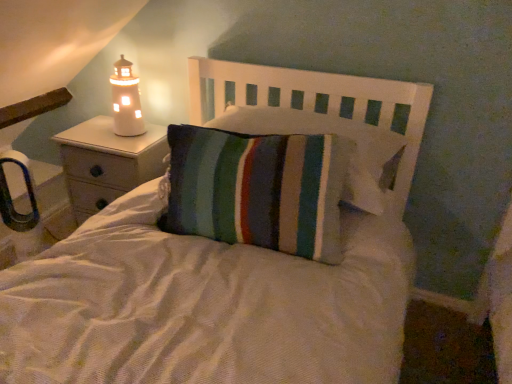
What do you see at coordinates (218, 289) in the screenshot?
I see `striped fabric pillow at center` at bounding box center [218, 289].

The width and height of the screenshot is (512, 384). Describe the element at coordinates (327, 133) in the screenshot. I see `striped fabric pillow at center` at that location.

Find the location of a particular element. The height and width of the screenshot is (384, 512). white ceramic lighthouse at left is located at coordinates (126, 100).

Is matte white nightstand at left not close to striped fabric pillow at center?

Actually, matte white nightstand at left and striped fabric pillow at center are a little close together.

Which is in front, matte white nightstand at left or striped fabric pillow at center?

striped fabric pillow at center is in front.

Considering the sizes of objects matte white nightstand at left and striped fabric pillow at center in the image provided, who is taller, matte white nightstand at left or striped fabric pillow at center?

matte white nightstand at left is taller.

Considering the sizes of matte white nightstand at left and striped fabric pillow at center in the image, is matte white nightstand at left bigger or smaller than striped fabric pillow at center?

In the image, matte white nightstand at left appears to be larger than striped fabric pillow at center.

Between white ceramic lighthouse at left and matte white nightstand at left, which one has less height?

Standing shorter between the two is white ceramic lighthouse at left.

Are white ceramic lighthouse at left and matte white nightstand at left located far from each other?

No, white ceramic lighthouse at left is not far from matte white nightstand at left.

Is white ceramic lighthouse at left thinner than matte white nightstand at left?

Yes, white ceramic lighthouse at left is thinner than matte white nightstand at left.

Which point is more distant from viewer, [128,125] or [89,183]?

The point [89,183] is farther.

Based on the photo, from a real-world perspective, is matte white nightstand at left located beneath striped fabric pillow at center?

Indeed, from a real-world perspective, matte white nightstand at left is positioned beneath striped fabric pillow at center.

Is matte white nightstand at left positioned beyond the bounds of striped fabric pillow at center?

matte white nightstand at left is positioned outside striped fabric pillow at center.

From the image's perspective, is matte white nightstand at left below striped fabric pillow at center?

Indeed, from the image's perspective, matte white nightstand at left is shown beneath striped fabric pillow at center.

Can you tell me how much matte white nightstand at left and striped fabric pillow at center differ in facing direction?

The facing directions of matte white nightstand at left and striped fabric pillow at center are 0.744 degrees apart.

In the scene shown: Does striped fabric pillow at center contain white ceramic lighthouse at left?

Definitely not — white ceramic lighthouse at left is not inside striped fabric pillow at center.

Considering the relative positions of striped fabric pillow at center and white ceramic lighthouse at left in the image provided, is striped fabric pillow at center to the left or to the right of white ceramic lighthouse at left?

striped fabric pillow at center is to the right of white ceramic lighthouse at left.

How much distance is there between striped fabric pillow at center and white ceramic lighthouse at left?

A distance of 70.77 centimeters exists between striped fabric pillow at center and white ceramic lighthouse at left.

Can you confirm if striped fabric pillow at center is shorter than white ceramic lighthouse at left?

Indeed, striped fabric pillow at center has a lesser height compared to white ceramic lighthouse at left.

The width and height of the screenshot is (512, 384). Identify the location of nightstand below the white ceramic lighthouse at left (from a real-world perspective). (106, 162).

From a real-world perspective, between matte white nightstand at left and white ceramic lighthouse at left, who is vertically lower?

matte white nightstand at left.

In terms of width, does matte white nightstand at left look wider or thinner when compared to white ceramic lighthouse at left?

In the image, matte white nightstand at left appears to be wider than white ceramic lighthouse at left.

From the image's perspective, between matte white nightstand at left and white ceramic lighthouse at left, who is located below?

matte white nightstand at left appears lower in the image.

How many degrees apart are the facing directions of white ceramic lighthouse at left and striped fabric pillow at center?

white ceramic lighthouse at left and striped fabric pillow at center are facing 91.1 degrees away from each other.

Between point (140, 109) and point (336, 117), which one is positioned in front?

The point (336, 117) is in front.

Is white ceramic lighthouse at left next to striped fabric pillow at center?

They are not placed beside each other.

Is white ceramic lighthouse at left facing towards striped fabric pillow at center?

No, white ceramic lighthouse at left does not turn towards striped fabric pillow at center.

Between striped fabric pillow at center and matte white nightstand at left, which one has more height?

Standing taller between the two is matte white nightstand at left.

Which is behind, point (257, 132) or point (96, 131)?

The point (96, 131) is behind.

Considering the relative sizes of striped fabric pillow at center and matte white nightstand at left in the image provided, is striped fabric pillow at center thinner than matte white nightstand at left?

No, striped fabric pillow at center is not thinner than matte white nightstand at left.

Find the location of a particular element. pillow to the right of matte white nightstand at left is located at coordinates (327, 133).

You are a GUI agent. You are given a task and a screenshot of the screen. Output one action in this format:
    pyautogui.click(x=<x>, y=<y>)
    Task: Click on the lamp above the matte white nightstand at left (from the image's perspective)
    This screenshot has height=384, width=512.
    Given the screenshot: What is the action you would take?
    pyautogui.click(x=126, y=100)

Which object lies nearer to the anchor point matte white nightstand at left, striped fabric pillow at center or white ceramic lighthouse at left?

white ceramic lighthouse at left.

Considering their positions, is white ceramic lighthouse at left positioned closer to striped fabric pillow at center than matte white nightstand at left?

The object closer to striped fabric pillow at center is matte white nightstand at left.

When comparing their distances from matte white nightstand at left, does striped fabric pillow at center or striped fabric pillow at center seem further?

striped fabric pillow at center lies further to matte white nightstand at left than the other object.

Considering their positions, is striped fabric pillow at center positioned further to striped fabric pillow at center than matte white nightstand at left?

The object further to striped fabric pillow at center is matte white nightstand at left.

Considering their positions, is matte white nightstand at left positioned further to striped fabric pillow at center than striped fabric pillow at center?

Among the two, matte white nightstand at left is located further to striped fabric pillow at center.

Based on their spatial positions, is matte white nightstand at left or striped fabric pillow at center closer to white ceramic lighthouse at left?

The object closer to white ceramic lighthouse at left is matte white nightstand at left.

When comparing their distances from matte white nightstand at left, does striped fabric pillow at center or striped fabric pillow at center seem closer?

Among the two, striped fabric pillow at center is located nearer to matte white nightstand at left.

Estimate the real-world distances between objects in this image. Which object is further from striped fabric pillow at center, striped fabric pillow at center or matte white nightstand at left?

Based on the image, matte white nightstand at left appears to be further to striped fabric pillow at center.

I want to click on pillow positioned between striped fabric pillow at center and matte white nightstand at left from near to far, so pyautogui.click(x=327, y=133).

The height and width of the screenshot is (384, 512). I want to click on lamp positioned between striped fabric pillow at center and matte white nightstand at left from near to far, so pos(126,100).

Identify the location of pillow positioned between striped fabric pillow at center and white ceramic lighthouse at left from near to far. This screenshot has height=384, width=512. (327, 133).

The width and height of the screenshot is (512, 384). Find the location of `lamp between matte white nightstand at left and striped fabric pillow at center from left to right`. lamp between matte white nightstand at left and striped fabric pillow at center from left to right is located at coordinates [126, 100].